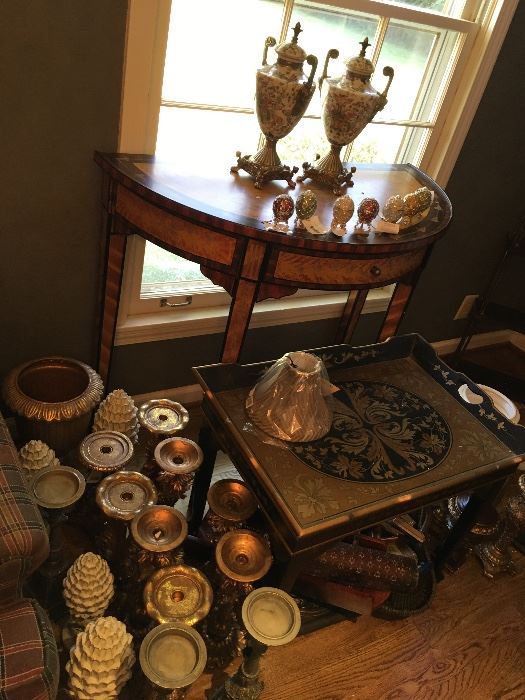
Locate an element on the screen. The height and width of the screenshot is (700, 525). window is located at coordinates (423, 68).